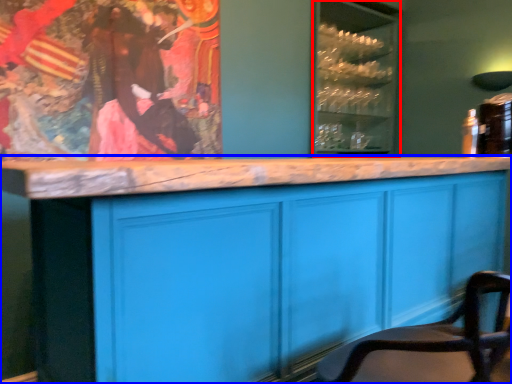
Question: Which point is further to the camera, glass door (highlighted by a red box) or cabinetry (highlighted by a blue box)?

Choices:
 (A) glass door
 (B) cabinetry

Answer: (A)